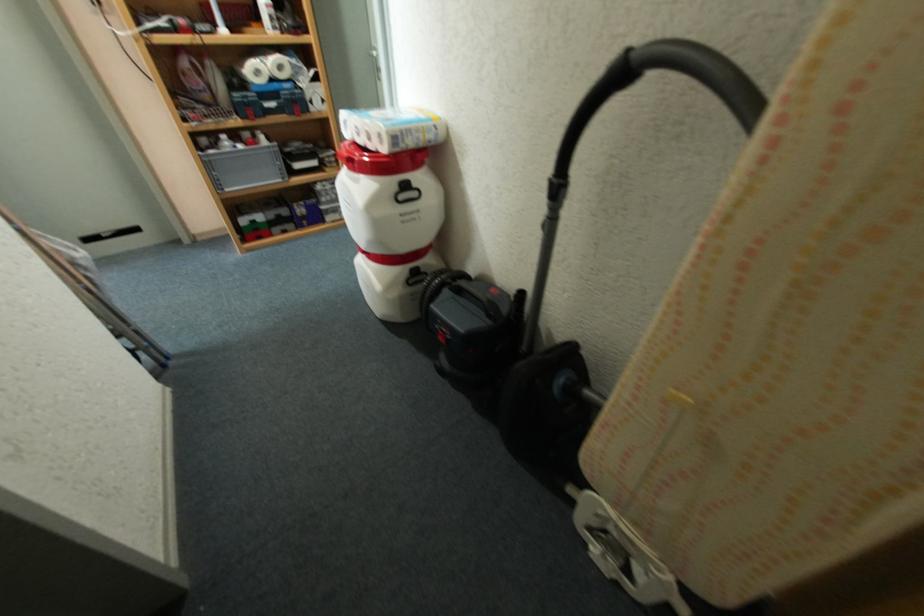
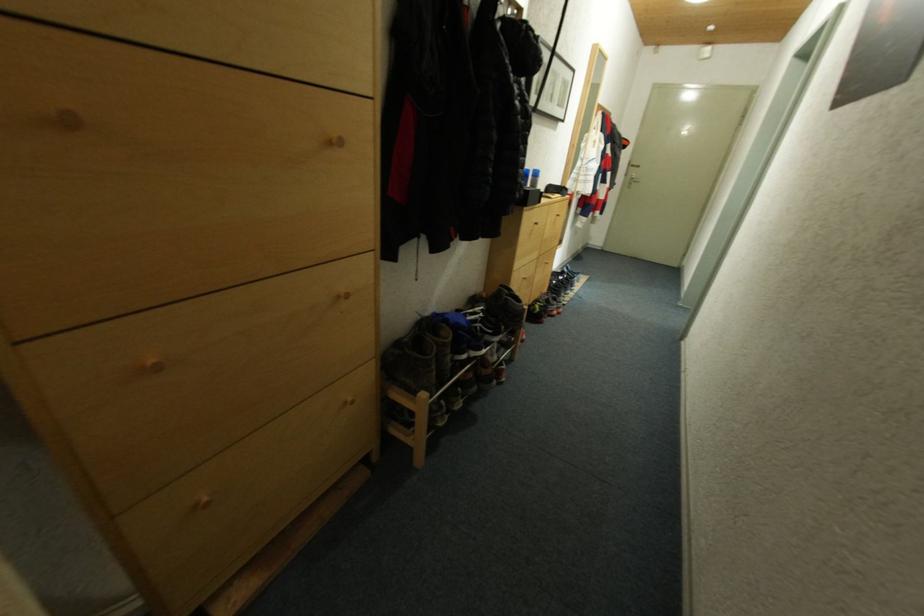
The first image is from the beginning of the video and the second image is from the end. How did the camera likely rotate when shooting the video?

The camera rotated toward right-down.